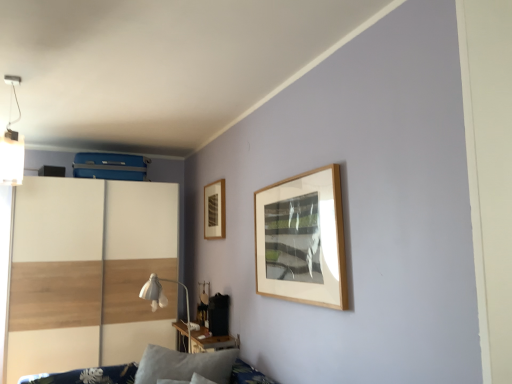
Question: Considering the relative sizes of white fabric table lamp at center and blue fabric sofa at lower left in the image provided, is white fabric table lamp at center shorter than blue fabric sofa at lower left?

Choices:
 (A) no
 (B) yes

Answer: (A)

Question: Is white fabric table lamp at center in front of blue fabric sofa at lower left?

Choices:
 (A) yes
 (B) no

Answer: (B)

Question: Is white fabric table lamp at center not within blue fabric sofa at lower left?

Choices:
 (A) no
 (B) yes

Answer: (B)

Question: From the image's perspective, is white fabric table lamp at center beneath blue fabric sofa at lower left?

Choices:
 (A) no
 (B) yes

Answer: (A)

Question: Is blue fabric sofa at lower left at the back of white fabric table lamp at center?

Choices:
 (A) yes
 (B) no

Answer: (B)

Question: From a real-world perspective, is white fabric table lamp at center physically below blue fabric sofa at lower left?

Choices:
 (A) yes
 (B) no

Answer: (B)

Question: From the image's perspective, is white fabric table lamp at center above wooden picture frame at upper left?

Choices:
 (A) no
 (B) yes

Answer: (A)

Question: Is white fabric table lamp at center far away from wooden picture frame at upper left?

Choices:
 (A) no
 (B) yes

Answer: (A)

Question: Is white fabric table lamp at center positioned with its back to wooden picture frame at upper left?

Choices:
 (A) yes
 (B) no

Answer: (B)

Question: Is white fabric table lamp at center shorter than wooden picture frame at upper left?

Choices:
 (A) yes
 (B) no

Answer: (B)

Question: Considering the relative sizes of white fabric table lamp at center and wooden picture frame at upper left in the image provided, is white fabric table lamp at center wider than wooden picture frame at upper left?

Choices:
 (A) no
 (B) yes

Answer: (B)

Question: From the image's perspective, is white fabric table lamp at center located beneath wooden picture frame at upper left?

Choices:
 (A) yes
 (B) no

Answer: (A)

Question: Is gray fabric pillow at lower left in front of wooden picture frame at upper left?

Choices:
 (A) no
 (B) yes

Answer: (B)